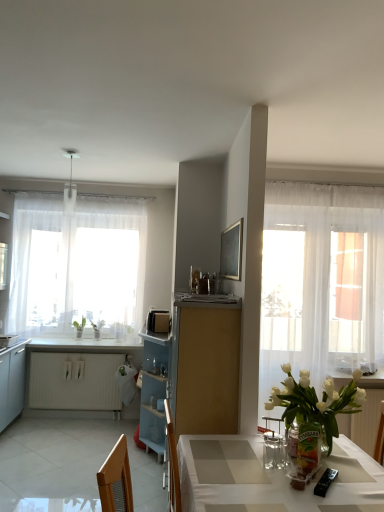
Identify the location of free region on the left part of black plastic remote control at lower right, the first appliance when ordered from right to left. (283, 482).